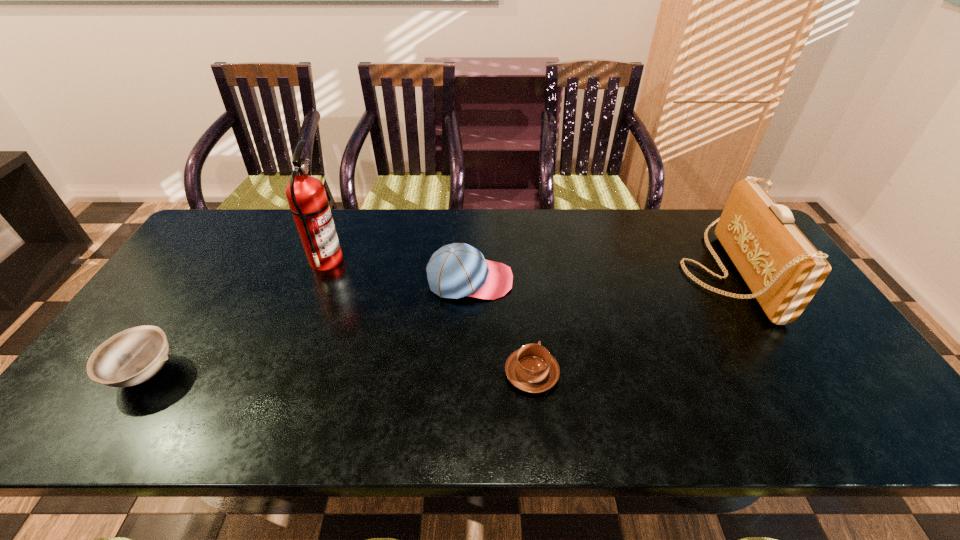
Locate an element on the screen. This screenshot has width=960, height=540. vacant space located 0.390m on the decorative side of the rightmost object is located at coordinates (552, 271).

Locate an element on the screen. free location located on the decorative side of the rightmost object is located at coordinates (659, 271).

Where is `free point located 0.190m on the front-facing side of the baseball cap`? This screenshot has height=540, width=960. free point located 0.190m on the front-facing side of the baseball cap is located at coordinates 577,280.

The height and width of the screenshot is (540, 960). In order to click on vacant space located 0.050m on the front of the leftmost object in this screenshot , I will do (111, 423).

What are the coordinates of `free spot located 0.350m on the side of the cappuccino with the handle` in the screenshot? It's located at (520, 261).

You are a GUI agent. You are given a task and a screenshot of the screen. Output one action in this format:
    pyautogui.click(x=<x>, y=<y>)
    Task: Click on the free region located 0.400m on the side of the cappuccino with the handle
    Image resolution: width=960 pixels, height=540 pixels.
    Given the screenshot: What is the action you would take?
    pyautogui.click(x=519, y=251)

I want to click on vacant position located 0.140m on the side of the cappuccino with the handle, so click(525, 311).

At what (x,y) coordinates should I click in order to perform the action: click on fire extinguisher located at the far edge. Please return your answer as a coordinate pair (x, y). Looking at the image, I should click on (309, 205).

This screenshot has width=960, height=540. In order to click on handbag at the far edge in this screenshot , I will do `click(782, 268)`.

Locate an element on the screen. The image size is (960, 540). object that is at the left edge is located at coordinates (133, 356).